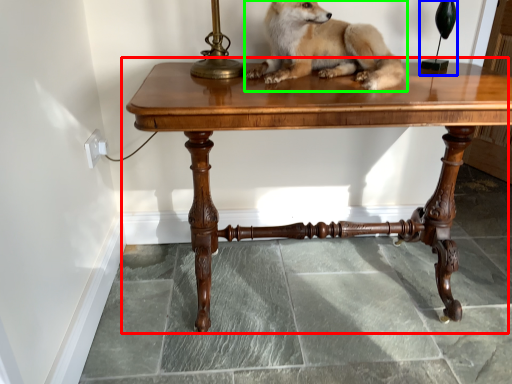
Question: Estimate the real-world distances between objects in this image. Which object is farther from table (highlighted by a red box), table lamp (highlighted by a blue box) or dog (highlighted by a green box)?

Choices:
 (A) table lamp
 (B) dog

Answer: (A)